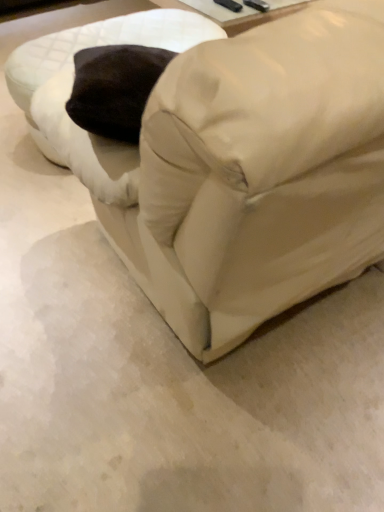
Image resolution: width=384 pixels, height=512 pixels. Find the location of `white fabric swivel chair at upper left`. white fabric swivel chair at upper left is located at coordinates (72, 84).

Measure the distance between white fabric swivel chair at upper left and camera.

The distance of white fabric swivel chair at upper left from camera is 5.20 feet.

Describe the element at coordinates (72, 84) in the screenshot. I see `white fabric swivel chair at upper left` at that location.

The image size is (384, 512). Find the location of `matte white couch at center`. matte white couch at center is located at coordinates (257, 173).

What do you see at coordinates (257, 173) in the screenshot? Image resolution: width=384 pixels, height=512 pixels. I see `matte white couch at center` at bounding box center [257, 173].

At what (x,y) coordinates should I click in order to perform the action: click on white fabric swivel chair at upper left. Please return your answer as a coordinate pair (x, y). Looking at the image, I should click on (72, 84).

Looking at this image, is white fabric swivel chair at upper left at the left side of matte white couch at center?

Yes, white fabric swivel chair at upper left is to the left of matte white couch at center.

Is white fabric swivel chair at upper left further to the viewer compared to matte white couch at center?

That is True.

Is point (54, 33) in front of point (367, 176)?

No, (54, 33) is behind (367, 176).

From the image's perspective, is white fabric swivel chair at upper left located beneath matte white couch at center?

No, from the image's perspective, white fabric swivel chair at upper left is not beneath matte white couch at center.

From a real-world perspective, which is physically below, white fabric swivel chair at upper left or matte white couch at center?

white fabric swivel chair at upper left, from a real-world perspective.

Consider the image. Can you confirm if white fabric swivel chair at upper left is wider than matte white couch at center?

No.

Which of these two, white fabric swivel chair at upper left or matte white couch at center, stands taller?

With more height is matte white couch at center.

Does white fabric swivel chair at upper left have a larger size compared to matte white couch at center?

No.

Can matte white couch at center be found inside white fabric swivel chair at upper left?

That's incorrect, matte white couch at center is not inside white fabric swivel chair at upper left.

Is white fabric swivel chair at upper left directly adjacent to matte white couch at center?

white fabric swivel chair at upper left and matte white couch at center are not in contact.

Is white fabric swivel chair at upper left oriented away from matte white couch at center?

Correct, white fabric swivel chair at upper left is looking away from matte white couch at center.

What's the angular difference between white fabric swivel chair at upper left and matte white couch at center's facing directions?

There is a 0.51-degree angle between the facing directions of white fabric swivel chair at upper left and matte white couch at center.

You are a GUI agent. You are given a task and a screenshot of the screen. Output one action in this format:
    pyautogui.click(x=<x>, y=<y>)
    Task: Click on the furniture in front of the white fabric swivel chair at upper left
    This screenshot has width=384, height=512.
    Given the screenshot: What is the action you would take?
    pyautogui.click(x=257, y=173)

Is matte white couch at center to the left or to the right of white fabric swivel chair at upper left in the image?

Clearly, matte white couch at center is on the right of white fabric swivel chair at upper left in the image.

Does matte white couch at center come in front of white fabric swivel chair at upper left?

Yes, it is in front of white fabric swivel chair at upper left.

Does point (248, 63) appear closer or farther from the camera than point (138, 169)?

Point (248, 63) appears to be closer to the viewer than point (138, 169).

From the image's perspective, is matte white couch at center on top of white fabric swivel chair at upper left?

No.

Based on the photo, from a real-world perspective, is matte white couch at center physically located above or below white fabric swivel chair at upper left?

In terms of real-world spatial position, matte white couch at center is above white fabric swivel chair at upper left.

Can you confirm if matte white couch at center is wider than white fabric swivel chair at upper left?

Yes.

Considering the relative sizes of matte white couch at center and white fabric swivel chair at upper left in the image provided, is matte white couch at center shorter than white fabric swivel chair at upper left?

No, matte white couch at center is not shorter than white fabric swivel chair at upper left.

Considering the sizes of objects matte white couch at center and white fabric swivel chair at upper left in the image provided, who is bigger, matte white couch at center or white fabric swivel chair at upper left?

With larger size is matte white couch at center.

In the scene shown: Is white fabric swivel chair at upper left surrounded by matte white couch at center?

No, white fabric swivel chair at upper left is not a part of matte white couch at center.

Is matte white couch at center beside white fabric swivel chair at upper left?

matte white couch at center and white fabric swivel chair at upper left are clearly separated.

Is matte white couch at center oriented towards white fabric swivel chair at upper left?

Yes.

You are a GUI agent. You are given a task and a screenshot of the screen. Output one action in this format:
    pyautogui.click(x=<x>, y=<y>)
    Task: Click on the furniture on the right of white fabric swivel chair at upper left
    Image resolution: width=384 pixels, height=512 pixels.
    Given the screenshot: What is the action you would take?
    pyautogui.click(x=257, y=173)

I want to click on furniture in front of the white fabric swivel chair at upper left, so click(x=257, y=173).

I want to click on swivel chair above the matte white couch at center (from the image's perspective), so click(72, 84).